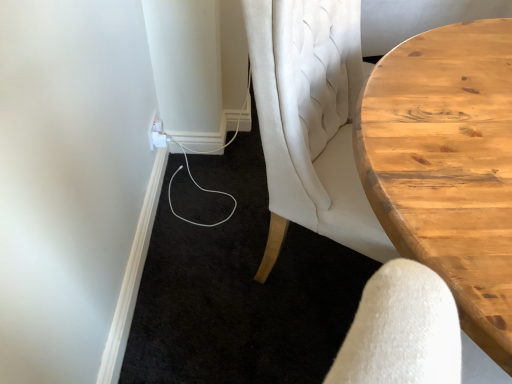
Question: Should I look upward or downward to see white plastic outlet at lower left?

Choices:
 (A) up
 (B) down

Answer: (A)

Question: From the image's perspective, is white plastic outlet at lower left beneath wooden table at right?

Choices:
 (A) no
 (B) yes

Answer: (A)

Question: Is white plastic outlet at lower left turned away from wooden table at right?

Choices:
 (A) no
 (B) yes

Answer: (A)

Question: From a real-world perspective, is white plastic outlet at lower left positioned over wooden table at right based on gravity?

Choices:
 (A) no
 (B) yes

Answer: (A)

Question: Would you say white plastic outlet at lower left is outside wooden table at right?

Choices:
 (A) no
 (B) yes

Answer: (B)

Question: Does white plastic outlet at lower left have a lesser height compared to wooden table at right?

Choices:
 (A) yes
 (B) no

Answer: (A)

Question: Is white plastic outlet at lower left at the left side of wooden table at right?

Choices:
 (A) no
 (B) yes

Answer: (B)

Question: Is wooden table at right positioned with its back to white plastic outlet at lower left?

Choices:
 (A) yes
 (B) no

Answer: (B)

Question: Is white plastic outlet at lower left completely or partially inside wooden table at right?

Choices:
 (A) no
 (B) yes

Answer: (A)

Question: Can you confirm if wooden table at right is thinner than white plastic outlet at lower left?

Choices:
 (A) yes
 (B) no

Answer: (B)

Question: From the image's perspective, is wooden table at right below white plastic outlet at lower left?

Choices:
 (A) yes
 (B) no

Answer: (A)

Question: Would you consider wooden table at right to be distant from white plastic outlet at lower left?

Choices:
 (A) no
 (B) yes

Answer: (B)

Question: Considering the relative sizes of wooden table at right and white plastic outlet at lower left in the image provided, is wooden table at right bigger than white plastic outlet at lower left?

Choices:
 (A) yes
 (B) no

Answer: (A)

Question: Is white plastic outlet at lower left bigger or smaller than wooden table at right?

Choices:
 (A) small
 (B) big

Answer: (A)